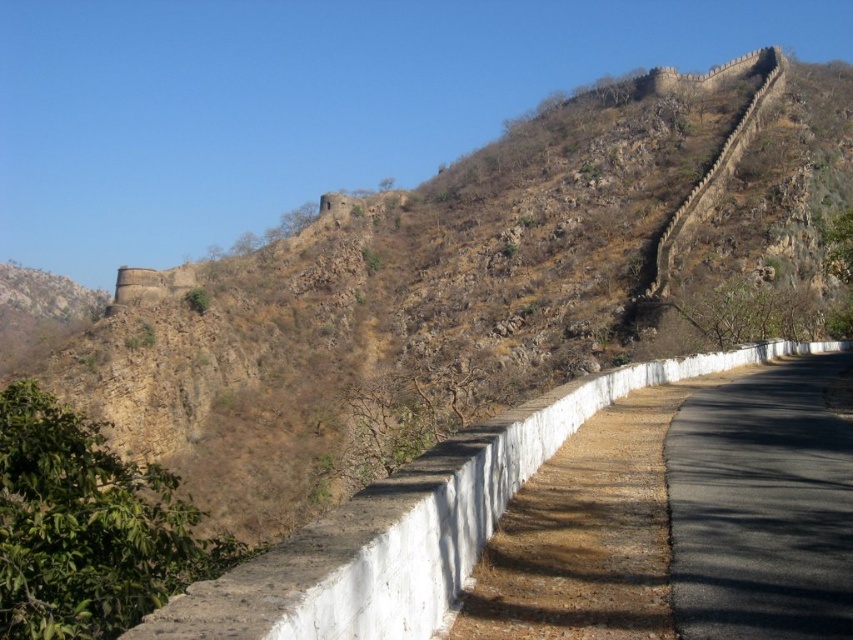
Can you confirm if white stone wall at center is taller than black asphalt road at center?

Indeed, white stone wall at center has a greater height compared to black asphalt road at center.

Who is shorter, white stone wall at center or black asphalt road at center?

With less height is black asphalt road at center.

You are a GUI agent. You are given a task and a screenshot of the screen. Output one action in this format:
    pyautogui.click(x=<x>, y=<y>)
    Task: Click on the white stone wall at center
    
    Given the screenshot: What is the action you would take?
    pyautogui.click(x=415, y=524)